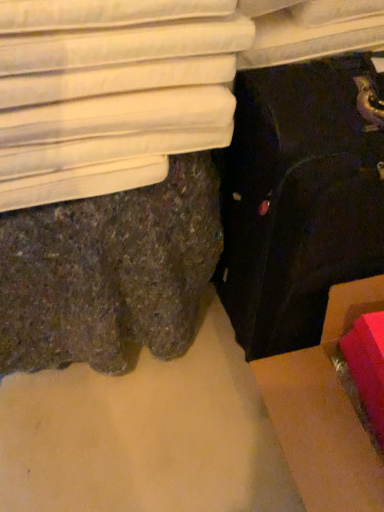
Question: Is white fabric bed at upper left not within cardboard box at lower right?

Choices:
 (A) yes
 (B) no

Answer: (A)

Question: Is white fabric bed at upper left at the right side of cardboard box at lower right?

Choices:
 (A) no
 (B) yes

Answer: (A)

Question: Considering the relative sizes of white fabric bed at upper left and cardboard box at lower right in the image provided, is white fabric bed at upper left smaller than cardboard box at lower right?

Choices:
 (A) no
 (B) yes

Answer: (B)

Question: Could you tell me if white fabric bed at upper left is facing cardboard box at lower right?

Choices:
 (A) yes
 (B) no

Answer: (B)

Question: Is white fabric bed at upper left shorter than cardboard box at lower right?

Choices:
 (A) no
 (B) yes

Answer: (B)

Question: From a real-world perspective, relative to white fabric bed at upper left, is cardboard box at lower right vertically above or below?

Choices:
 (A) below
 (B) above

Answer: (A)

Question: Is point (337, 495) closer or farther from the camera than point (115, 178)?

Choices:
 (A) closer
 (B) farther

Answer: (B)

Question: Would you say cardboard box at lower right is to the left or to the right of white fabric bed at upper left in the picture?

Choices:
 (A) left
 (B) right

Answer: (B)

Question: From the image's perspective, is cardboard box at lower right positioned above or below white fabric bed at upper left?

Choices:
 (A) below
 (B) above

Answer: (A)

Question: In the image, is white fabric bed at upper left positioned in front of or behind black fabric suitcase at lower right?

Choices:
 (A) behind
 (B) front

Answer: (A)

Question: Is white fabric bed at upper left spatially inside black fabric suitcase at lower right, or outside of it?

Choices:
 (A) inside
 (B) outside

Answer: (B)

Question: From the image's perspective, is white fabric bed at upper left located above or below black fabric suitcase at lower right?

Choices:
 (A) above
 (B) below

Answer: (A)

Question: Is point (314, 34) positioned closer to the camera than point (324, 162)?

Choices:
 (A) farther
 (B) closer

Answer: (A)

Question: From the image's perspective, is white fabric bed at upper left located above or below cardboard box at lower right?

Choices:
 (A) below
 (B) above

Answer: (B)

Question: From a real-world perspective, is white fabric bed at upper left above or below cardboard box at lower right?

Choices:
 (A) above
 (B) below

Answer: (A)